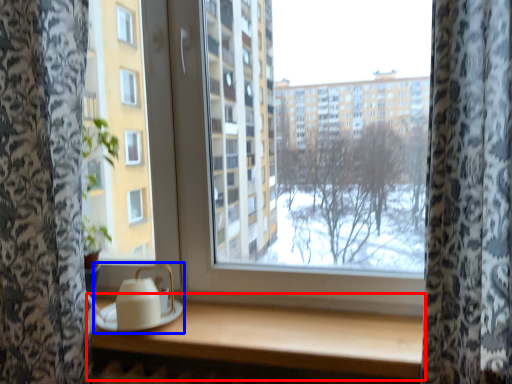
Question: Which object appears farthest to the camera in this image, table (highlighted by a red box) or tea set (highlighted by a blue box)?

Choices:
 (A) table
 (B) tea set

Answer: (B)